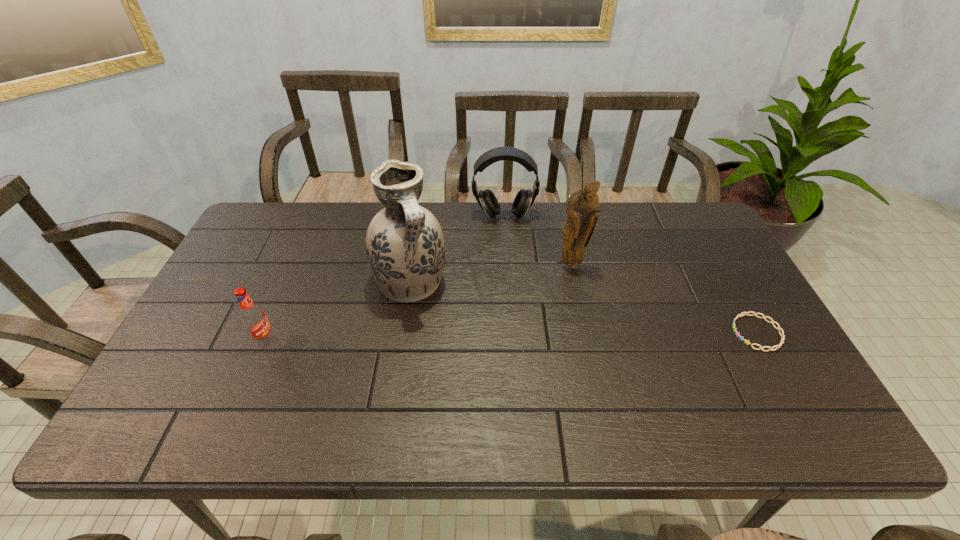
Image resolution: width=960 pixels, height=540 pixels. What are the coordinates of `root beer` in the screenshot? It's located at (253, 317).

Image resolution: width=960 pixels, height=540 pixels. I want to click on the leftmost object, so click(x=253, y=317).

Locate an element on the screen. Image resolution: width=960 pixels, height=540 pixels. bracelet is located at coordinates (778, 328).

At what (x,y) coordinates should I click in order to perform the action: click on the rightmost object. Please return your answer as a coordinate pair (x, y). This screenshot has width=960, height=540. Looking at the image, I should click on (778, 328).

Locate an element on the screen. This screenshot has height=540, width=960. the tallest object is located at coordinates (405, 247).

Identify the location of the fourth object from right to left. (405, 247).

What are the coordinates of `the third tallest object` in the screenshot? It's located at (524, 199).

Locate an element on the screen. Image resolution: width=960 pixels, height=540 pixels. earphone is located at coordinates (524, 199).

What are the coordinates of `figurine` in the screenshot? It's located at (582, 206).

Find the location of a particular element. The width and height of the screenshot is (960, 540). the second object from right to left is located at coordinates (582, 206).